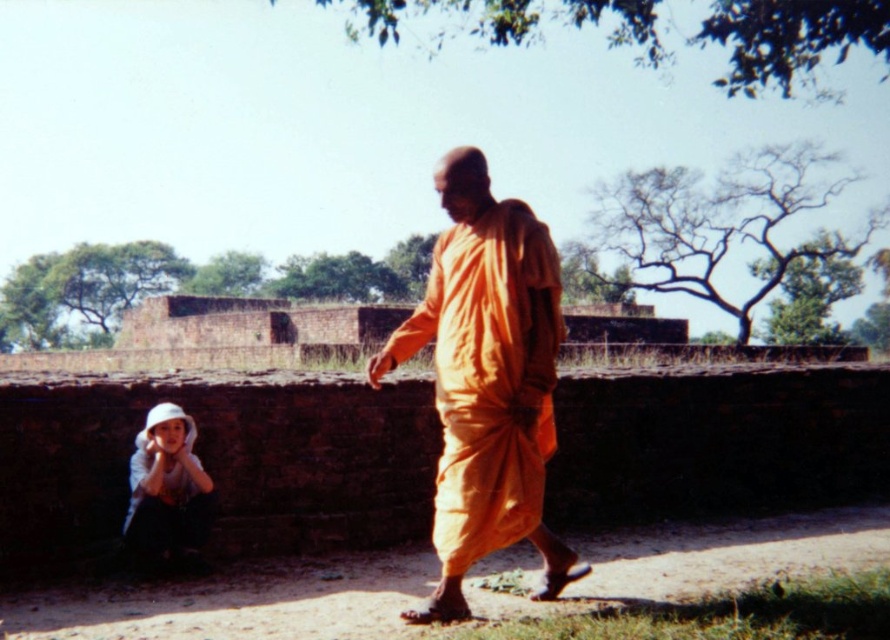
Based on the photo, you are standing at the point with coordinates point (142, 438) and want to walk towards the point with coordinates point (508, 484). Which direction should you face to move directly towards your destination?

You should face towards the direction where point (508, 484) is located, which is in front of point (142, 438), so you need to move forward in that direction to reach your destination.

You are standing at the point marked as point (487, 380). What is the object you are standing on?

The point (487, 380) is on the orange clothed monk at center, so you are standing on the orange clothed monk at center.